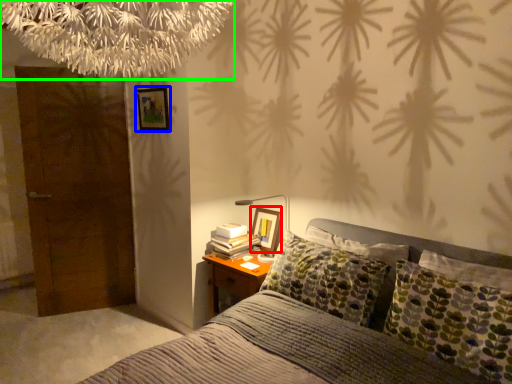
Question: Based on their relative distances, which object is farther from picture frame (highlighted by a red box)? Choose from picture frame (highlighted by a blue box) and tree (highlighted by a green box).

Choices:
 (A) picture frame
 (B) tree

Answer: (B)